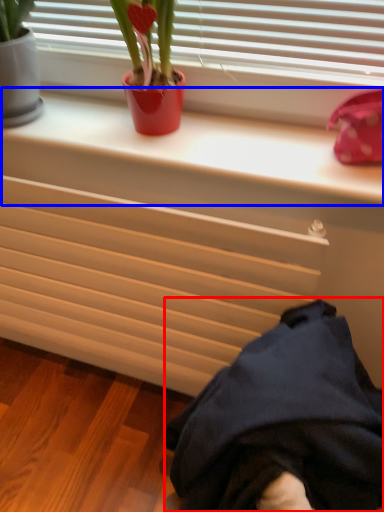
Question: Among these objects, which one is nearest to the camera, clothing (highlighted by a red box) or window sill (highlighted by a blue box)?

Choices:
 (A) clothing
 (B) window sill

Answer: (A)